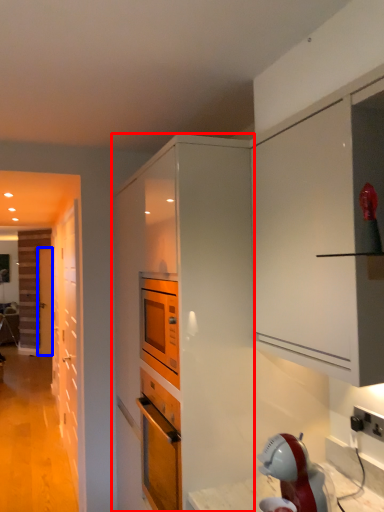
Question: Which of the following is the farthest to the observer, cabinetry (highlighted by a red box) or door (highlighted by a blue box)?

Choices:
 (A) cabinetry
 (B) door

Answer: (B)